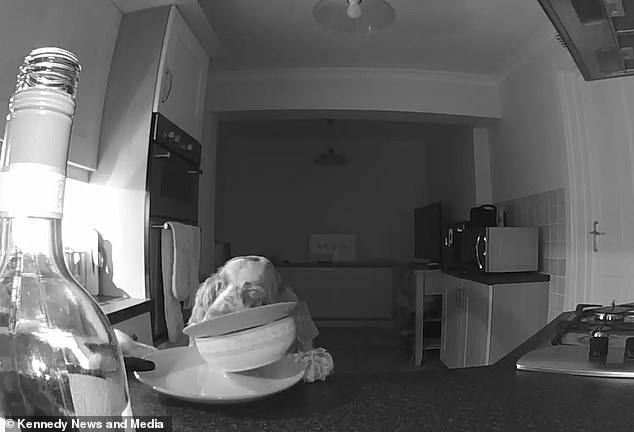
The height and width of the screenshot is (432, 634). In order to click on white bowl in this screenshot , I will do `click(252, 351)`.